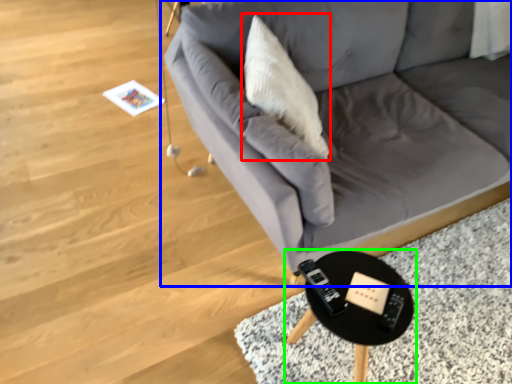
Question: Which is farther away from throw pillow (highlighted by a red box)? studio couch (highlighted by a blue box) or table (highlighted by a green box)?

Choices:
 (A) studio couch
 (B) table

Answer: (B)